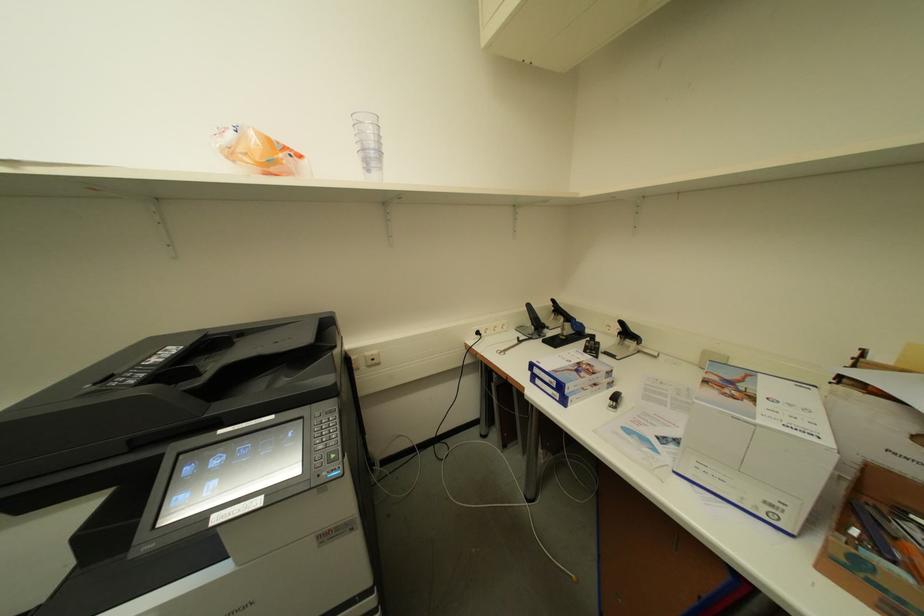
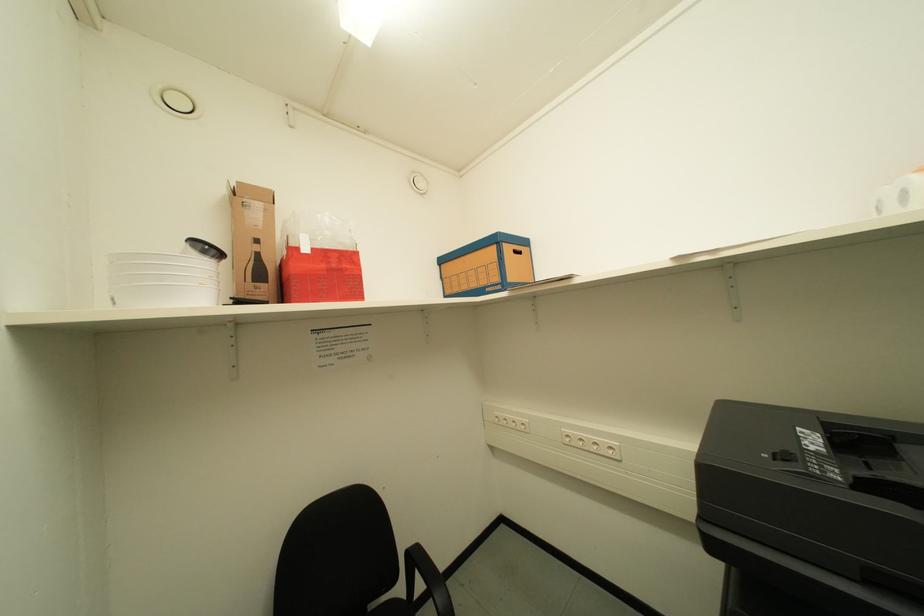
Question: How did the camera likely rotate?

Choices:
 (A) Left
 (B) Right
 (C) Up
 (D) Down

Answer: (A)